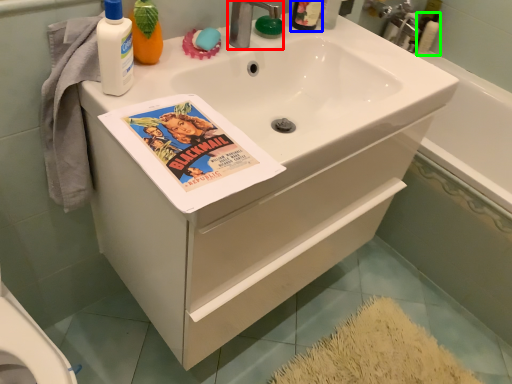
Question: Which object is positioned farthest from tap (highlighted by a red box)? Select from mouthwash (highlighted by a blue box) and cleaning product (highlighted by a green box).

Choices:
 (A) mouthwash
 (B) cleaning product

Answer: (B)